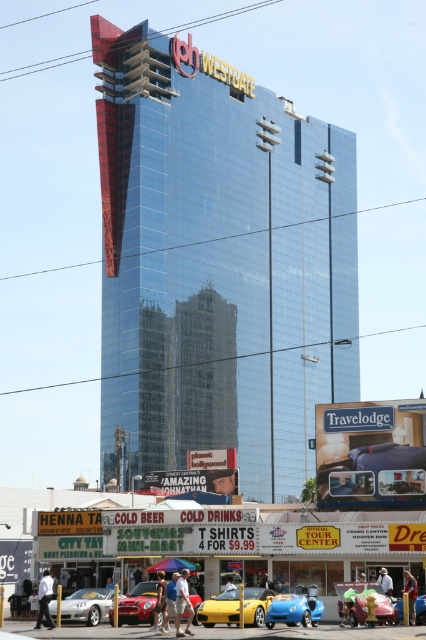
Measure the distance between metallic yellow car at center and camera.

A distance of 46.63 meters exists between metallic yellow car at center and camera.

Which is more to the right, metallic yellow car at center or green fabric pants at lower center?

From the viewer's perspective, metallic yellow car at center appears more on the right side.

Which is behind, point (420, 604) or point (342, 604)?

The point (342, 604) is more distant.

Image resolution: width=426 pixels, height=640 pixels. I want to click on metallic yellow car at center, so click(420, 609).

Does shiny glass building at center lie behind metallic red car at center?

Yes, shiny glass building at center is further from the viewer.

Which is in front, point (331, 228) or point (149, 609)?

Point (149, 609)

Who is more distant from viewer, (121,460) or (144,620)?

The point (121,460) is behind.

Where is `shiny glass building at center`? shiny glass building at center is located at coordinates (218, 262).

Does yellow matte car at center appear over light blue denim shorts at lower center?

No.

Can you confirm if yellow matte car at center is shorter than light blue denim shorts at lower center?

In fact, yellow matte car at center may be taller than light blue denim shorts at lower center.

You are a GUI agent. You are given a task and a screenshot of the screen. Output one action in this format:
    pyautogui.click(x=<x>, y=<y>)
    Task: Click on the yellow matte car at center
    This screenshot has width=426, height=640.
    Given the screenshot: What is the action you would take?
    pyautogui.click(x=363, y=602)